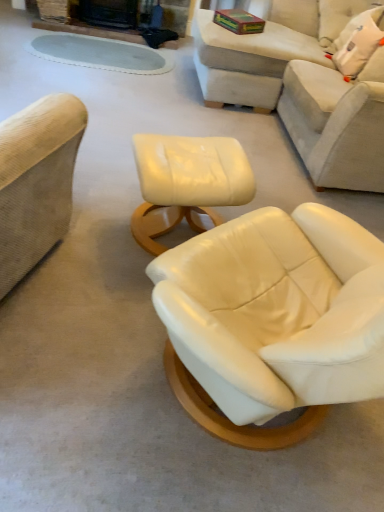
Question: Considering the positions of beige leather couch at upper right and beige leather couch at upper right in the image, is beige leather couch at upper right bigger or smaller than beige leather couch at upper right?

Choices:
 (A) big
 (B) small

Answer: (B)

Question: From their relative heights in the image, would you say beige leather couch at upper right is taller or shorter than beige leather couch at upper right?

Choices:
 (A) short
 (B) tall

Answer: (A)

Question: Considering the real-world distances, which object is farthest from the beige leather couch at upper right?

Choices:
 (A) white fabric pillow at upper right
 (B) beige leather couch at upper right
 (C) matte cream ottoman at center

Answer: (C)

Question: Considering the real-world distances, which object is farthest from the white fabric pillow at upper right?

Choices:
 (A) beige leather couch at upper right
 (B) matte cream ottoman at center
 (C) beige leather couch at upper right

Answer: (B)